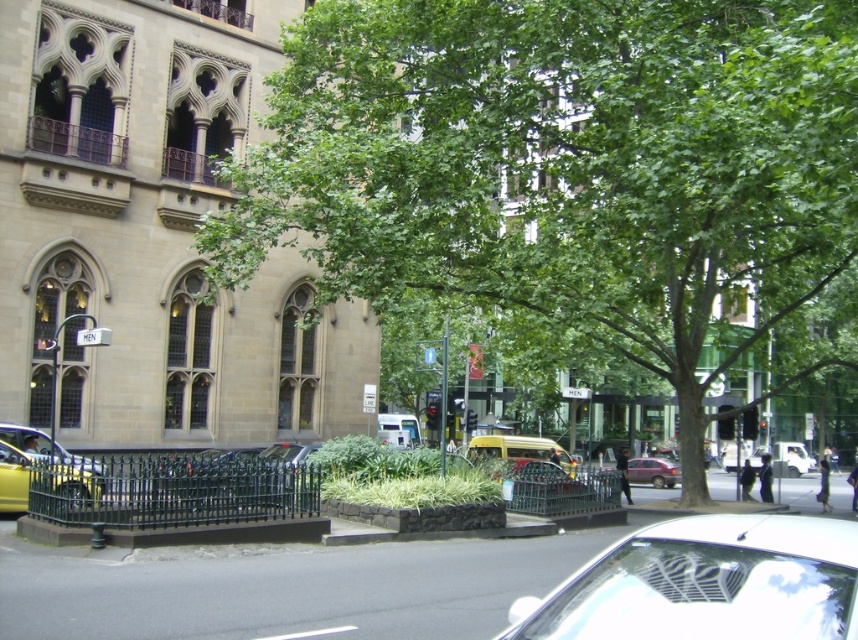
Question: Which object is closer to the camera taking this photo?

Choices:
 (A) green leafy tree at center
 (B) matte red car at center

Answer: (A)

Question: Is green leafy tree at center further to camera compared to yellow matte taxi at center?

Choices:
 (A) yes
 (B) no

Answer: (B)

Question: Estimate the real-world distances between objects in this image. Which object is closer to the yellow matte taxi at center?

Choices:
 (A) yellow matte taxi at left
 (B) matte red car at center
 (C) white glossy car at lower right
 (D) green leafy tree at center

Answer: (D)

Question: Can you confirm if yellow matte taxi at center is bigger than matte red car at center?

Choices:
 (A) yes
 (B) no

Answer: (A)

Question: Which object is positioned closest to the white glossy car at lower right?

Choices:
 (A) yellow matte taxi at center
 (B) matte red car at center
 (C) yellow matte taxi cab at left

Answer: (C)

Question: Does yellow matte taxi cab at left appear on the left side of matte red car at center?

Choices:
 (A) no
 (B) yes

Answer: (B)